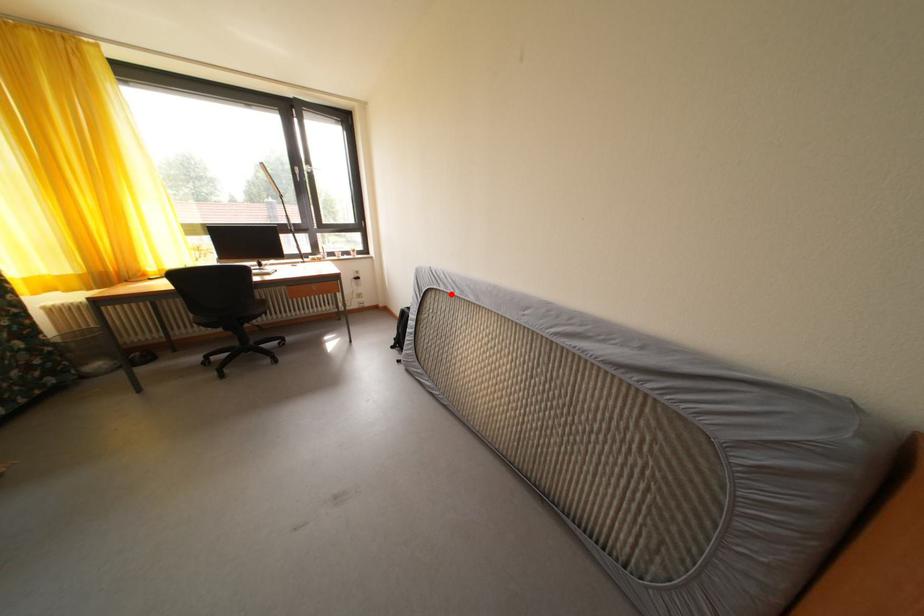
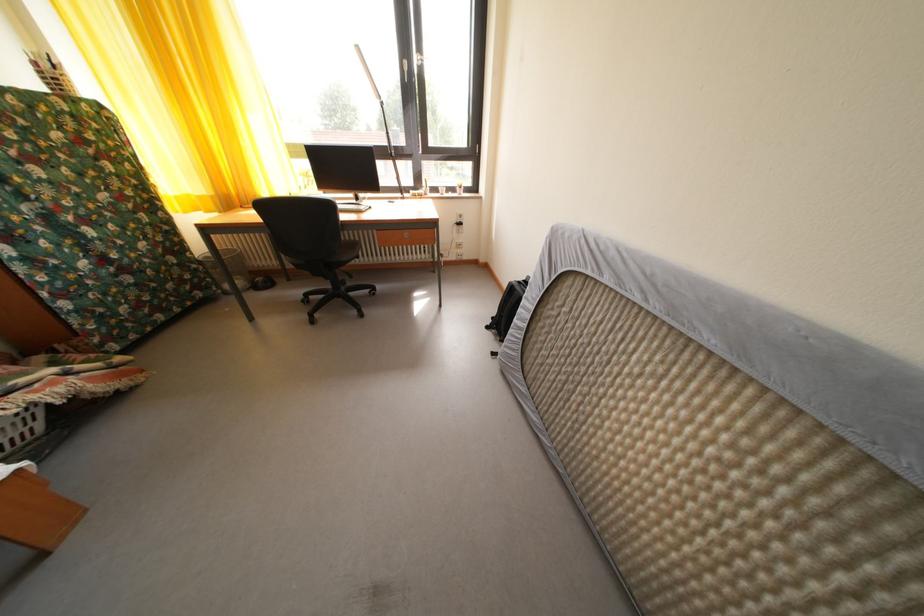
Question: I am providing you with two images of the same scene from different viewpoints. In image1, a red point is highlighted. Considering the same 3D point in image2, which of the following is correct?

Choices:
 (A) It is closer
 (B) It is farther

Answer: (A)